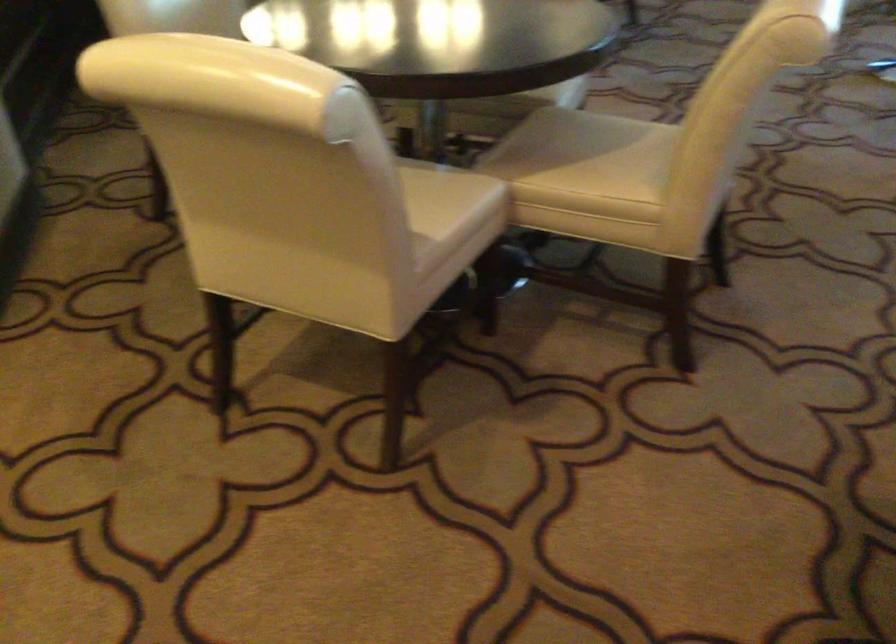
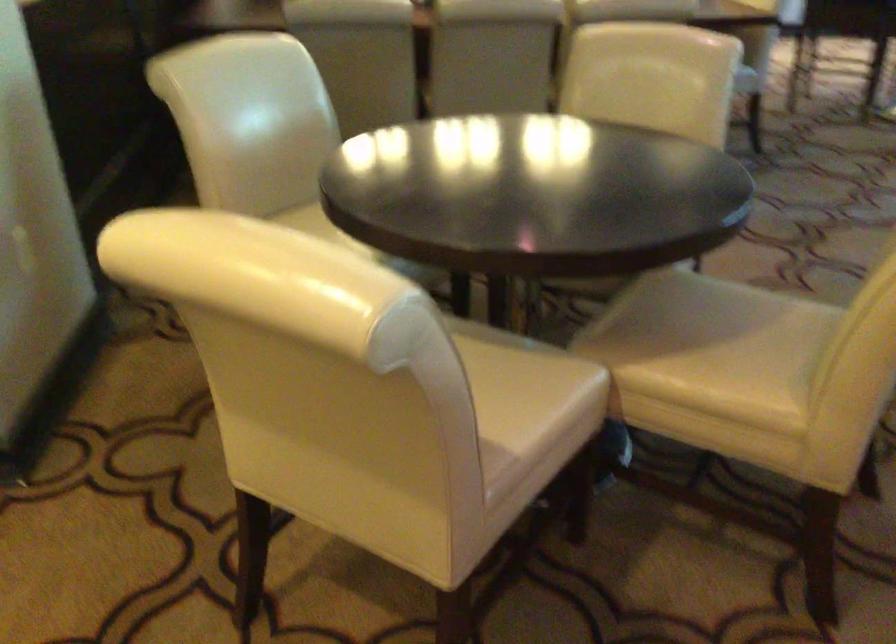
Question: The images are taken continuously from a first-person perspective. In which direction are you moving?

Choices:
 (A) Left
 (B) Right
 (C) Forward
 (D) Backward

Answer: (C)